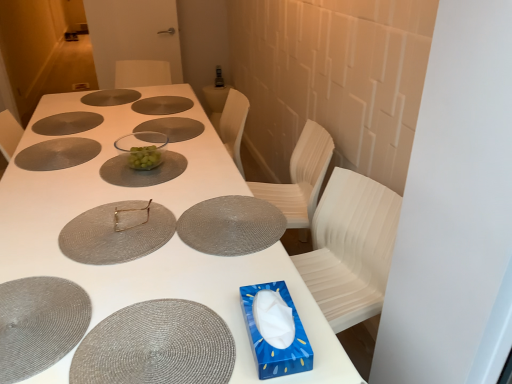
This screenshot has width=512, height=384. In order to click on vacant area that lies between matte gray placemat at lower center, the ninth glass plate from the back, and matte gray placemat at center, placed as the seventh glass plate when sorted from back to front in this screenshot , I will do `click(195, 274)`.